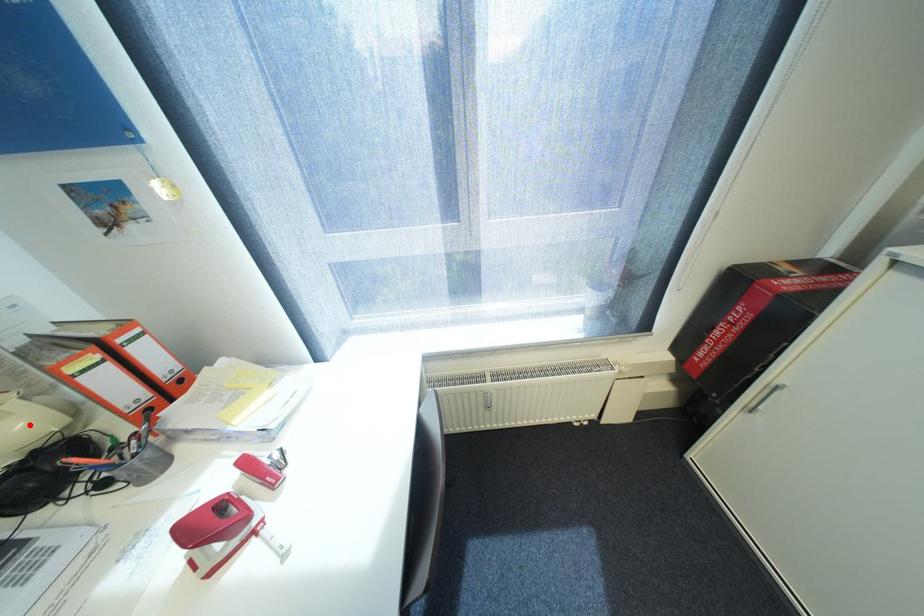
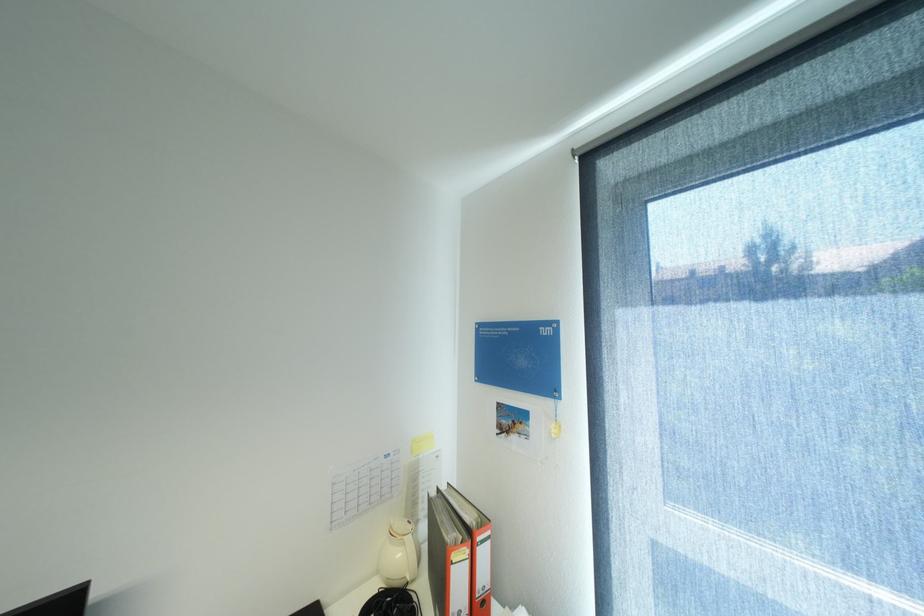
Locate, in the second image, the point that corresponds to the highlighted location in the first image.

(407, 554)